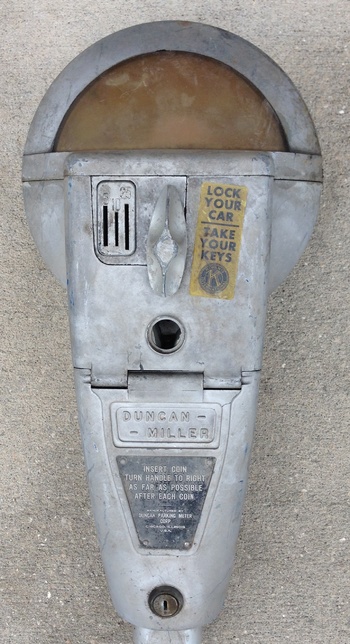
Identify the location of sticker. The image size is (350, 644). (228, 245).